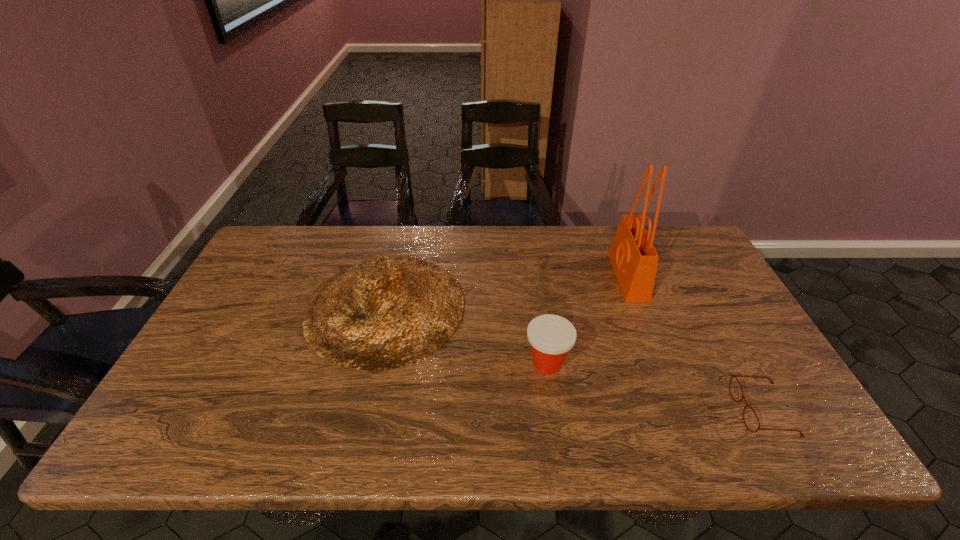
Locate an element on the screen. This screenshot has width=960, height=540. free space between the leftmost object and the rightmost object is located at coordinates (574, 359).

Locate an element on the screen. free space between the leftmost object and the tote bag is located at coordinates (507, 292).

The image size is (960, 540). I want to click on free space between the third shortest object and the rightmost object, so click(x=574, y=359).

You are a GUI agent. You are given a task and a screenshot of the screen. Output one action in this format:
    pyautogui.click(x=<x>, y=<y>)
    Task: Click on the free space that is in between the second object from right to left and the third shortest object
    
    Given the screenshot: What is the action you would take?
    pyautogui.click(x=507, y=292)

Locate an element on the screen. The width and height of the screenshot is (960, 540). free area in between the third object from left to right and the leftmost object is located at coordinates (507, 292).

The width and height of the screenshot is (960, 540). In order to click on free spot between the leftmost object and the spectacles in this screenshot , I will do `click(574, 359)`.

This screenshot has height=540, width=960. I want to click on vacant space in between the spectacles and the sunhat, so (574, 359).

Identify which object is the closest to the Dixie cup. Please provide its 2D coordinates. Your answer should be formatted as a tuple, i.e. [(x, y)], where the tuple contains the x and y coordinates of a point satisfying the conditions above.

[(387, 312)]

Select which object is the third closest to the nearest object. Please provide its 2D coordinates. Your answer should be formatted as a tuple, i.e. [(x, y)], where the tuple contains the x and y coordinates of a point satisfying the conditions above.

[(387, 312)]

The image size is (960, 540). In order to click on free location that satisfies the following two spatial constraints: 1. on the front side of the third shortest object; 2. on the left side of the second object from left to right in this screenshot , I will do `click(372, 363)`.